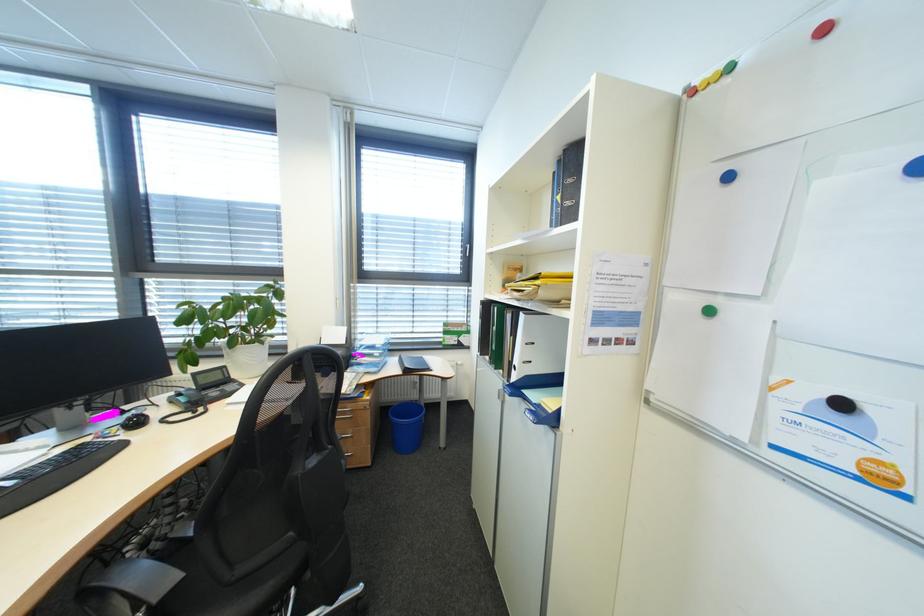
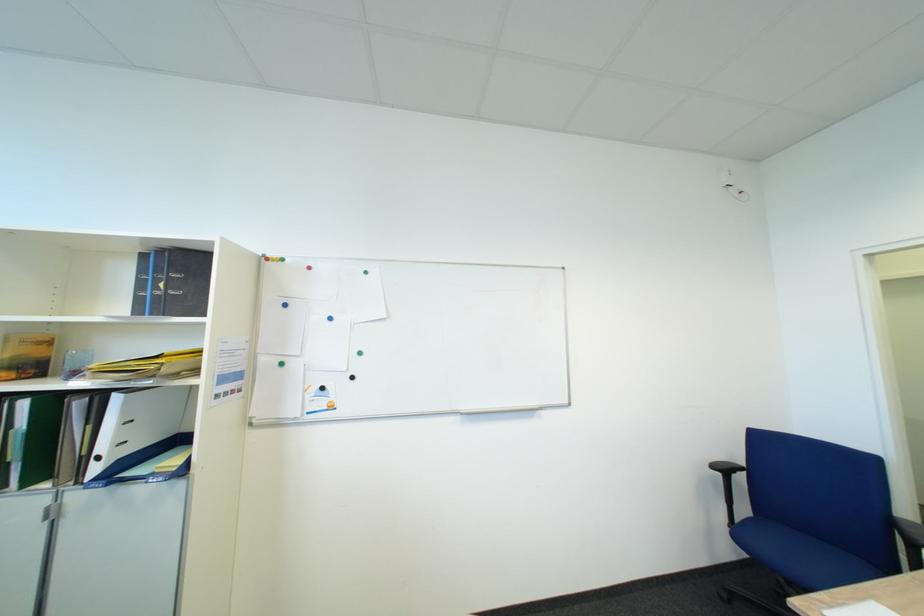
Question: The camera is either moving clockwise (left) or counter-clockwise (right) around the object. The first image is from the beginning of the video and the second image is from the end. Is the camera moving left or right when shooting the video?

Choices:
 (A) Left
 (B) Right

Answer: (A)